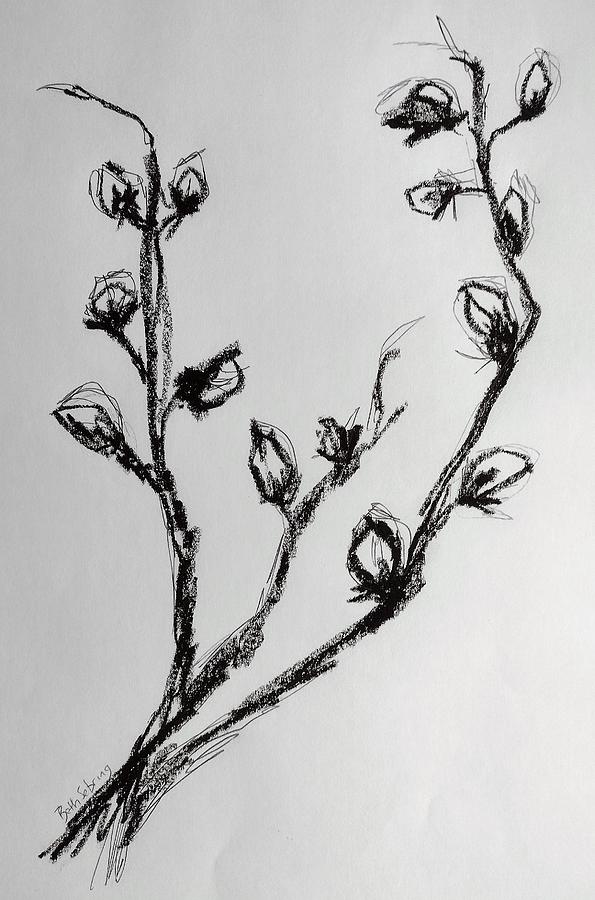
Where is `plant`? The image size is (595, 900). plant is located at coordinates (355, 634).